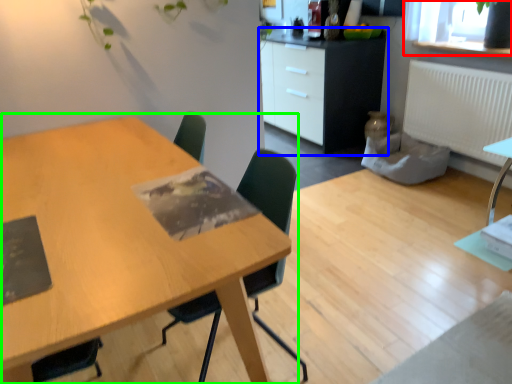
Question: Considering the real-world distances, which object is farthest from window screen (highlighted by a red box)? cabinetry (highlighted by a blue box) or table (highlighted by a green box)?

Choices:
 (A) cabinetry
 (B) table

Answer: (B)